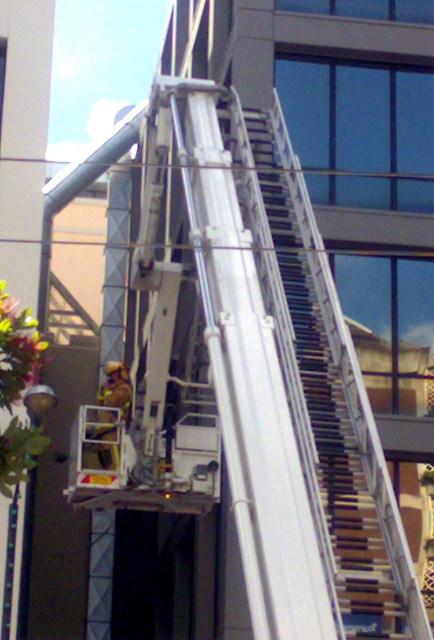
You are a firefighter on the ground looking up at the white wooden stairs at upper right marked by point (x=325, y=392). The aerial ladder is currently at its highest position. Can you reach the stairs with the ladder?

The point (x=325, y=392) marks white wooden stairs at upper right. Since the ladder is at its highest position, it can reach the stairs marked by that point.

You are a firefighter who needs to reach the camera located on the roof of the building. The white wooden stairs at upper right are part of the building. Can you use the aerial ladder to reach the camera from the bucket? Explain your reasoning based on the distance provided.

The white wooden stairs at upper right and the camera are 18.08 meters apart. Since the aerial ladder is extended upwards against the building and the firefighter is in the bucket, the distance between the stairs and the camera suggests that the ladder may not reach the camera unless it can extend beyond 18.08 meters. However, without knowing the ladder length, it is uncertain. The question should be rephrased to include ladder length details.

You are a firefighter trying to reach the orange reflective safety vest at center. There are white wooden stairs at upper right nearby. Which direction should you move to get closer to the vest?

The white wooden stairs at upper right is positioned on the right side of orange reflective safety vest at center, so to reach the vest, you should move to the left.